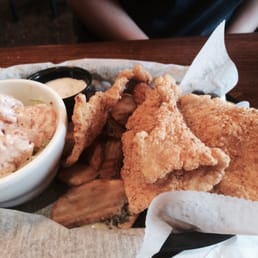
Where is `brown carpeting`? The height and width of the screenshot is (258, 258). brown carpeting is located at coordinates (34, 34).